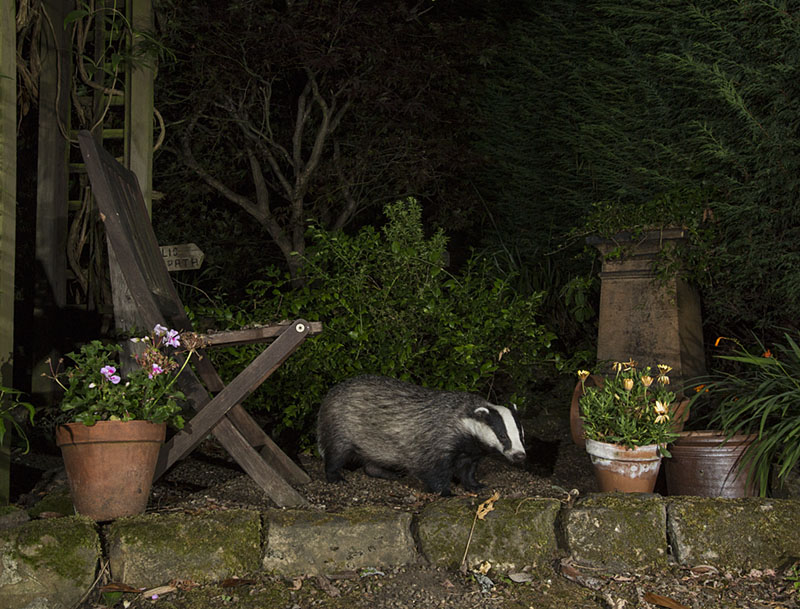
Image resolution: width=800 pixels, height=609 pixels. What are the coordinates of `potted plants` in the screenshot? It's located at (633, 463), (122, 452).